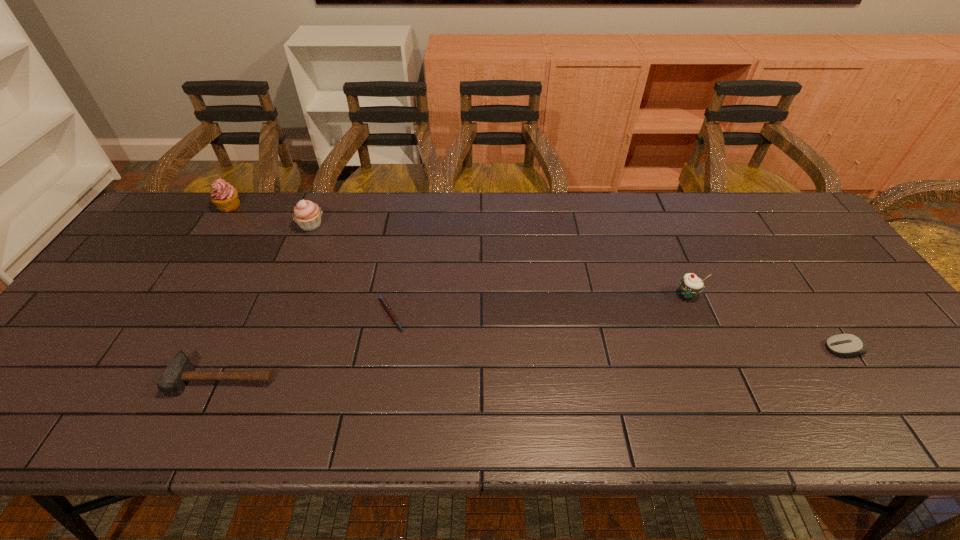
Locate an element on the screen. This screenshot has width=960, height=540. object positioned at the right edge is located at coordinates (842, 344).

Where is `object that is at the far left corner`? This screenshot has height=540, width=960. object that is at the far left corner is located at coordinates (224, 196).

Identify the location of free space at the far edge of the desktop. This screenshot has height=540, width=960. (453, 214).

Where is `vacant region at the near edge`? The image size is (960, 540). vacant region at the near edge is located at coordinates (226, 406).

I want to click on vacant space at the left edge, so click(93, 328).

In the image, there is a desktop. In order to click on blank space at the far left corner in this screenshot , I will do `click(184, 222)`.

Where is `vacant area that lies between the leftmost cupcake and the pen`? Image resolution: width=960 pixels, height=540 pixels. vacant area that lies between the leftmost cupcake and the pen is located at coordinates (310, 260).

This screenshot has height=540, width=960. I want to click on free area in between the nearest cupcake and the fifth farthest object, so click(765, 322).

The height and width of the screenshot is (540, 960). What are the coordinates of `empty space between the nearest object and the fourth object from left to right` in the screenshot? It's located at (307, 346).

This screenshot has height=540, width=960. I want to click on free space between the second farthest object and the nearest object, so click(x=268, y=301).